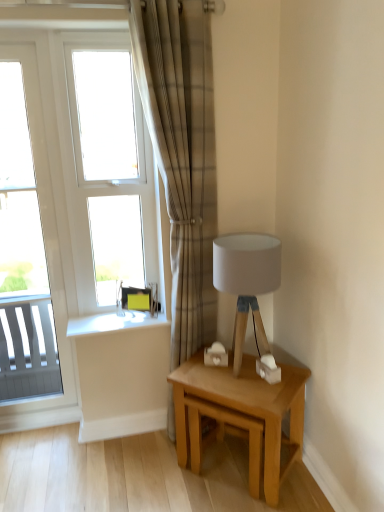
Identify the location of free space to the left of light oak wooden table at lower right. The height and width of the screenshot is (512, 384). (151, 475).